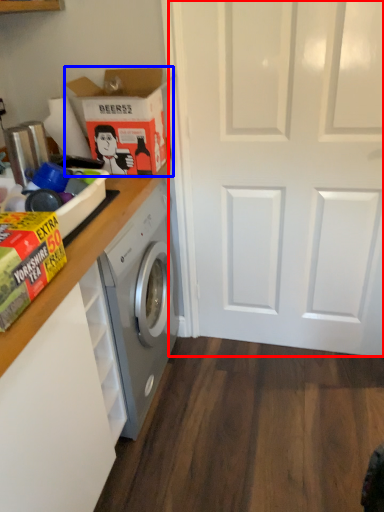
Question: Which object appears closest to the camera in this image, screen door (highlighted by a red box) or cardboard box (highlighted by a blue box)?

Choices:
 (A) screen door
 (B) cardboard box

Answer: (A)